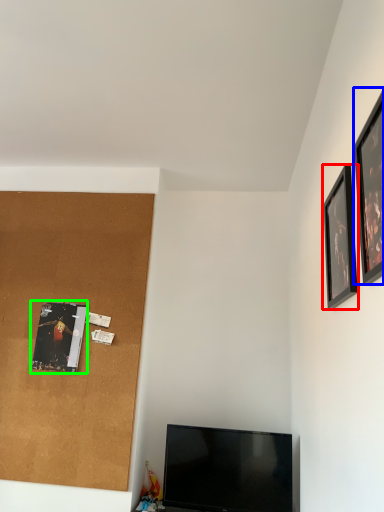
Question: Which object is the closest to the picture frame (highlighted by a red box)? Choose among these: picture frame (highlighted by a blue box) or picture frame (highlighted by a green box).

Choices:
 (A) picture frame
 (B) picture frame

Answer: (A)